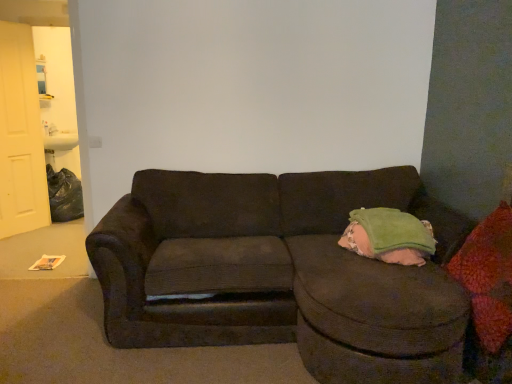
Measure the distance between point (412, 258) and camera.

Point (412, 258) and camera are 2.28 meters apart.

Describe the element at coordinates (389, 236) in the screenshot. I see `green corduroy bean bag chair at right` at that location.

Image resolution: width=512 pixels, height=384 pixels. Find the location of `white matte door at left`. white matte door at left is located at coordinates (20, 136).

Locate an element on the screen. green corduroy bean bag chair at right is located at coordinates (389, 236).

Which of these two, white matte door at left or green corduroy bean bag chair at right, stands taller?

white matte door at left.

From a real-world perspective, between white matte door at left and green corduroy bean bag chair at right, who is vertically lower?

green corduroy bean bag chair at right is physically lower.

Can you confirm if white matte door at left is positioned to the left of green corduroy bean bag chair at right?

Yes.

Is white matte door at left not close to green corduroy bean bag chair at right?

Yes, white matte door at left and green corduroy bean bag chair at right are quite far apart.

Does green corduroy bean bag chair at right turn towards red textured throw pillow at right?

Yes.

Which of these two, green corduroy bean bag chair at right or red textured throw pillow at right, stands taller?

red textured throw pillow at right is taller.

Which is more to the right, green corduroy bean bag chair at right or red textured throw pillow at right?

red textured throw pillow at right.

Does green corduroy bean bag chair at right have a smaller size compared to red textured throw pillow at right?

Indeed, green corduroy bean bag chair at right has a smaller size compared to red textured throw pillow at right.

Considering the positions of point (462, 241) and point (6, 53), is point (462, 241) closer or farther from the camera than point (6, 53)?

Point (462, 241) is positioned closer to the camera compared to point (6, 53).

Is white matte door at left located within dark corduroy couch at center?

No.

From the image's perspective, between dark corduroy couch at center and white matte door at left, which one is located above?

white matte door at left, from the image's perspective.

Considering the relative sizes of dark corduroy couch at center and white matte door at left in the image provided, is dark corduroy couch at center smaller than white matte door at left?

No, dark corduroy couch at center is not smaller than white matte door at left.

Considering the positions of points (29, 49) and (493, 227), is point (29, 49) closer to camera compared to point (493, 227)?

No, (29, 49) is further to viewer.

Would you say white matte door at left is a long distance from red textured throw pillow at right?

Yes, white matte door at left and red textured throw pillow at right are quite far apart.

Looking at the image, does white matte door at left seem bigger or smaller compared to red textured throw pillow at right?

Clearly, white matte door at left is larger in size than red textured throw pillow at right.

Could you tell me if white matte door at left is turned towards red textured throw pillow at right?

Yes.

Do you think red textured throw pillow at right is within green corduroy bean bag chair at right, or outside of it?

red textured throw pillow at right lies outside green corduroy bean bag chair at right.

Does red textured throw pillow at right have a larger size compared to green corduroy bean bag chair at right?

Correct, red textured throw pillow at right is larger in size than green corduroy bean bag chair at right.

Between red textured throw pillow at right and green corduroy bean bag chair at right, which one has larger width?

green corduroy bean bag chair at right is wider.

Are dark corduroy couch at center and green corduroy bean bag chair at right beside each other?

No, dark corduroy couch at center is not making contact with green corduroy bean bag chair at right.

Is dark corduroy couch at center located outside green corduroy bean bag chair at right?

Yes, dark corduroy couch at center is not within green corduroy bean bag chair at right.

From the image's perspective, does dark corduroy couch at center appear higher than green corduroy bean bag chair at right?

No, from the image's perspective, dark corduroy couch at center is not over green corduroy bean bag chair at right.

Consider the image. Is dark corduroy couch at center to the left of green corduroy bean bag chair at right from the viewer's perspective?

Indeed, dark corduroy couch at center is positioned on the left side of green corduroy bean bag chair at right.

Considering the relative sizes of red textured throw pillow at right and dark corduroy couch at center in the image provided, is red textured throw pillow at right thinner than dark corduroy couch at center?

Indeed, red textured throw pillow at right has a lesser width compared to dark corduroy couch at center.

Is red textured throw pillow at right aimed at dark corduroy couch at center?

Yes, red textured throw pillow at right is turned towards dark corduroy couch at center.

Considering the positions of point (466, 241) and point (348, 348), is point (466, 241) closer or farther from the camera than point (348, 348)?

Point (466, 241) appears to be farther away from the viewer than point (348, 348).

The width and height of the screenshot is (512, 384). Find the location of `bean bag chair below the white matte door at left (from the image's perspective)`. bean bag chair below the white matte door at left (from the image's perspective) is located at coordinates (389, 236).

Where is `bean bag chair that is behind the red textured throw pillow at right`? This screenshot has height=384, width=512. bean bag chair that is behind the red textured throw pillow at right is located at coordinates (389, 236).

Looking at the image, which one is located closer to white matte door at left, green corduroy bean bag chair at right or dark corduroy couch at center?

Among the two, dark corduroy couch at center is located nearer to white matte door at left.

From the image, which object appears to be farther from white matte door at left, red textured throw pillow at right or dark corduroy couch at center?

Based on the image, red textured throw pillow at right appears to be further to white matte door at left.

Estimate the real-world distances between objects in this image. Which object is closer to dark corduroy couch at center, white matte door at left or green corduroy bean bag chair at right?

green corduroy bean bag chair at right is positioned closer to the anchor dark corduroy couch at center.

When comparing their distances from white matte door at left, does dark corduroy couch at center or red textured throw pillow at right seem further?

Among the two, red textured throw pillow at right is located further to white matte door at left.

From the image, which object appears to be nearer to red textured throw pillow at right, green corduroy bean bag chair at right or white matte door at left?

Among the two, green corduroy bean bag chair at right is located nearer to red textured throw pillow at right.

Looking at the image, which one is located further to white matte door at left, green corduroy bean bag chair at right or red textured throw pillow at right?

The object further to white matte door at left is red textured throw pillow at right.

Considering their positions, is white matte door at left positioned further to green corduroy bean bag chair at right than dark corduroy couch at center?

Among the two, white matte door at left is located further to green corduroy bean bag chair at right.

Estimate the real-world distances between objects in this image. Which object is further from dark corduroy couch at center, red textured throw pillow at right or green corduroy bean bag chair at right?

red textured throw pillow at right is positioned further to the anchor dark corduroy couch at center.

The width and height of the screenshot is (512, 384). In order to click on studio couch situated between white matte door at left and green corduroy bean bag chair at right from left to right in this screenshot , I will do `click(282, 272)`.

What are the coordinates of `bean bag chair between white matte door at left and red textured throw pillow at right from left to right` in the screenshot? It's located at tap(389, 236).

In order to click on studio couch between white matte door at left and red textured throw pillow at right in the horizontal direction in this screenshot , I will do `click(282, 272)`.

The image size is (512, 384). Find the location of `bean bag chair between dark corduroy couch at center and red textured throw pillow at right from left to right`. bean bag chair between dark corduroy couch at center and red textured throw pillow at right from left to right is located at coordinates (389, 236).